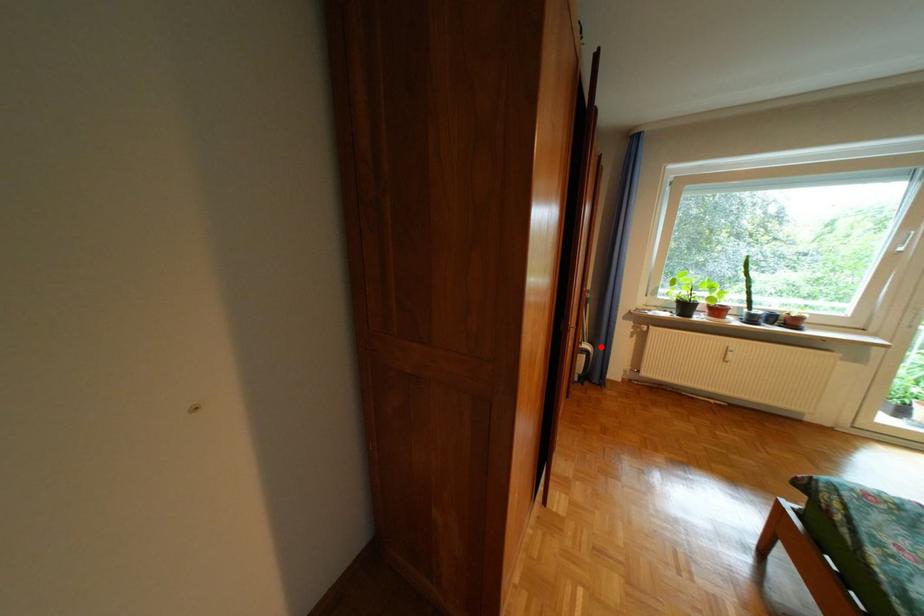
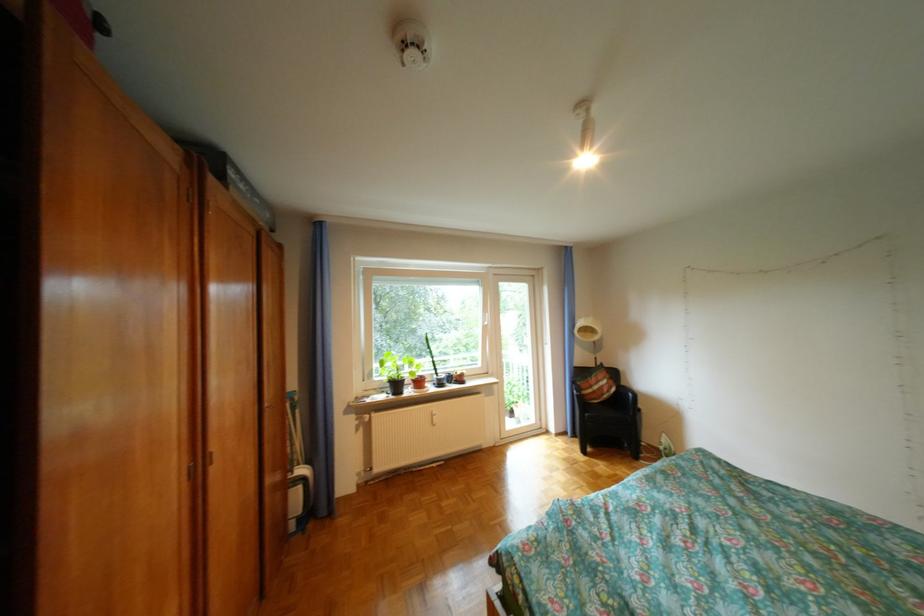
Question: I am providing you with two images of the same scene from different viewpoints. Image1 has a red point marked. In image2, the corresponding 3D location appears at what relative position? Reply with the corresponding letter.

Choices:
 (A) Closer
 (B) Farther

Answer: (B)